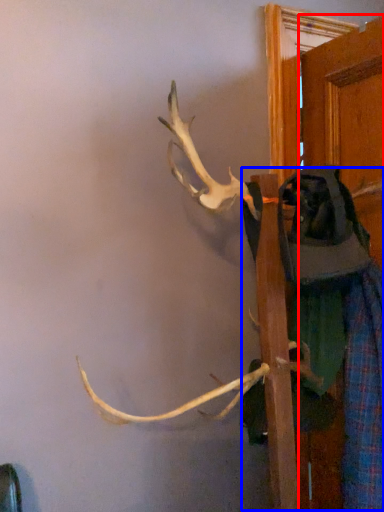
Question: Which point is closer to the camera, door (highlighted by a red box) or clothing (highlighted by a blue box)?

Choices:
 (A) door
 (B) clothing

Answer: (B)